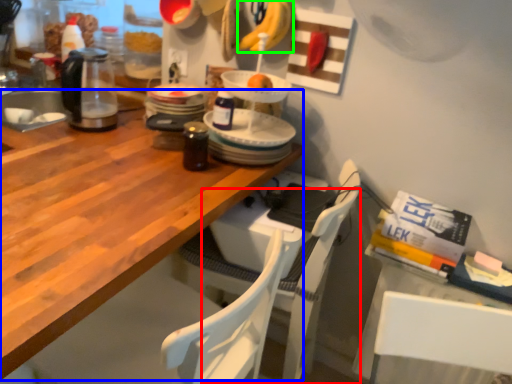
Question: Which object is positioned farthest from chair (highlighted by a red box)? Select from desk (highlighted by a blue box) and banana (highlighted by a green box).

Choices:
 (A) desk
 (B) banana

Answer: (B)